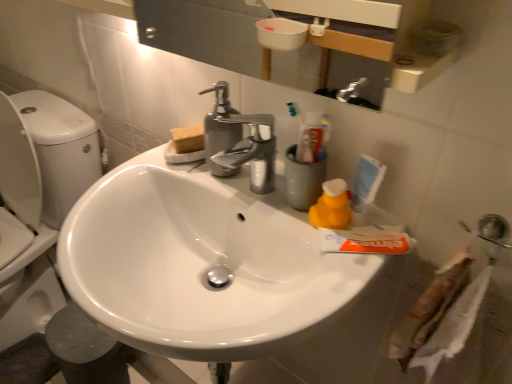
Where is `free region on the left part of white matte toothpaste at center`? This screenshot has height=384, width=512. free region on the left part of white matte toothpaste at center is located at coordinates (287, 234).